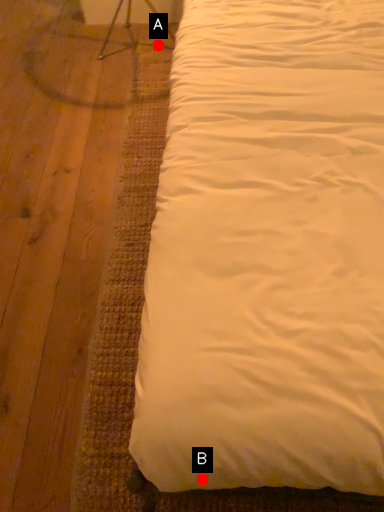
Question: Two points are circled on the image, labeled by A and B beside each circle. Which point is closer to the camera?

Choices:
 (A) A is closer
 (B) B is closer

Answer: (B)